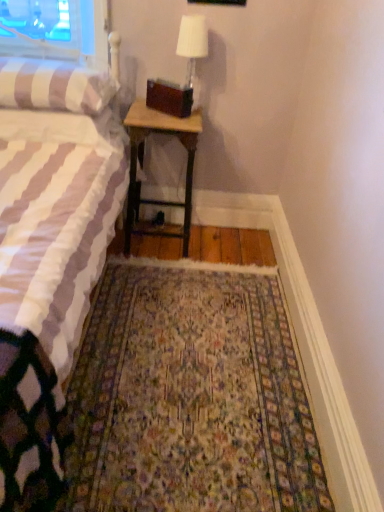
Question: Considering the relative sizes of white striped fabric bed at left and wooden nightstand at center in the image provided, is white striped fabric bed at left wider than wooden nightstand at center?

Choices:
 (A) no
 (B) yes

Answer: (B)

Question: Considering the relative sizes of white striped fabric bed at left and wooden nightstand at center in the image provided, is white striped fabric bed at left taller than wooden nightstand at center?

Choices:
 (A) yes
 (B) no

Answer: (A)

Question: Is white striped fabric bed at left next to wooden nightstand at center?

Choices:
 (A) yes
 (B) no

Answer: (B)

Question: Is wooden nightstand at center located within white striped fabric bed at left?

Choices:
 (A) yes
 (B) no

Answer: (A)

Question: From the image's perspective, is white striped fabric bed at left on top of wooden nightstand at center?

Choices:
 (A) yes
 (B) no

Answer: (B)

Question: Does point (182, 337) appear closer or farther from the camera than point (74, 119)?

Choices:
 (A) closer
 (B) farther

Answer: (B)

Question: Is floral carpet at center wider or thinner than white striped fabric bed at left?

Choices:
 (A) wide
 (B) thin

Answer: (B)

Question: Is floral carpet at center in front of or behind white striped fabric bed at left in the image?

Choices:
 (A) front
 (B) behind

Answer: (B)

Question: From the image's perspective, is floral carpet at center located above or below white striped fabric bed at left?

Choices:
 (A) above
 (B) below

Answer: (B)

Question: In the image, is wooden nightstand at center on the left side or the right side of white fabric lampshade at upper center?

Choices:
 (A) right
 (B) left

Answer: (B)

Question: Relative to white fabric lampshade at upper center, is wooden nightstand at center in front or behind?

Choices:
 (A) behind
 (B) front

Answer: (A)

Question: From a real-world perspective, is wooden nightstand at center above or below white fabric lampshade at upper center?

Choices:
 (A) below
 (B) above

Answer: (A)

Question: Is wooden nightstand at center wider or thinner than white fabric lampshade at upper center?

Choices:
 (A) wide
 (B) thin

Answer: (A)

Question: Is striped fabric pillow at left wider or thinner than floral carpet at center?

Choices:
 (A) thin
 (B) wide

Answer: (A)

Question: In terms of height, does striped fabric pillow at left look taller or shorter compared to floral carpet at center?

Choices:
 (A) tall
 (B) short

Answer: (A)